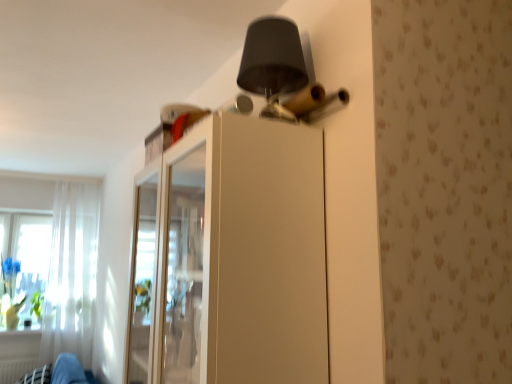
Question: Is white glossy cabinet at upper center positioned with its back to white sheer curtain at left?

Choices:
 (A) yes
 (B) no

Answer: (B)

Question: Considering the relative sizes of white glossy cabinet at upper center and white sheer curtain at left in the image provided, is white glossy cabinet at upper center thinner than white sheer curtain at left?

Choices:
 (A) yes
 (B) no

Answer: (B)

Question: Does white glossy cabinet at upper center have a lesser height compared to white sheer curtain at left?

Choices:
 (A) no
 (B) yes

Answer: (B)

Question: Is white glossy cabinet at upper center positioned behind white sheer curtain at left?

Choices:
 (A) no
 (B) yes

Answer: (A)

Question: Can you confirm if white glossy cabinet at upper center is taller than white sheer curtain at left?

Choices:
 (A) no
 (B) yes

Answer: (A)

Question: Considering the relative sizes of white glossy cabinet at upper center and white sheer curtain at left in the image provided, is white glossy cabinet at upper center smaller than white sheer curtain at left?

Choices:
 (A) no
 (B) yes

Answer: (A)

Question: Considering the relative sizes of white glossy cabinet at upper center and black fabric swivel chair at lower left in the image provided, is white glossy cabinet at upper center wider than black fabric swivel chair at lower left?

Choices:
 (A) no
 (B) yes

Answer: (A)

Question: Are white glossy cabinet at upper center and black fabric swivel chair at lower left making contact?

Choices:
 (A) yes
 (B) no

Answer: (B)

Question: Considering the relative positions of white glossy cabinet at upper center and black fabric swivel chair at lower left in the image provided, is white glossy cabinet at upper center to the right of black fabric swivel chair at lower left from the viewer's perspective?

Choices:
 (A) no
 (B) yes

Answer: (B)

Question: From the image's perspective, does white glossy cabinet at upper center appear lower than black fabric swivel chair at lower left?

Choices:
 (A) no
 (B) yes

Answer: (A)

Question: Is white glossy cabinet at upper center turned away from black fabric swivel chair at lower left?

Choices:
 (A) yes
 (B) no

Answer: (B)

Question: Is white glossy cabinet at upper center smaller than black fabric swivel chair at lower left?

Choices:
 (A) no
 (B) yes

Answer: (A)

Question: Is white sheer curtain at left further to camera compared to white glossy cabinet at upper center?

Choices:
 (A) no
 (B) yes

Answer: (B)